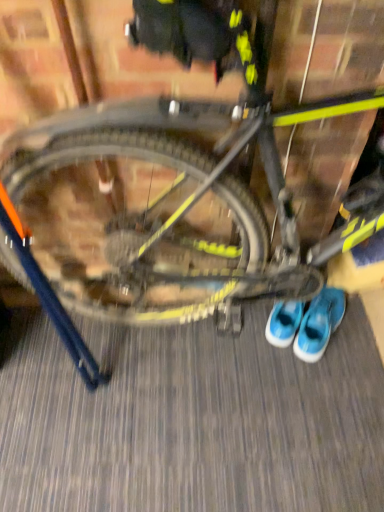
Where is `vacant space in front of blue suede sneakers at lower right`? The width and height of the screenshot is (384, 512). vacant space in front of blue suede sneakers at lower right is located at coordinates (327, 375).